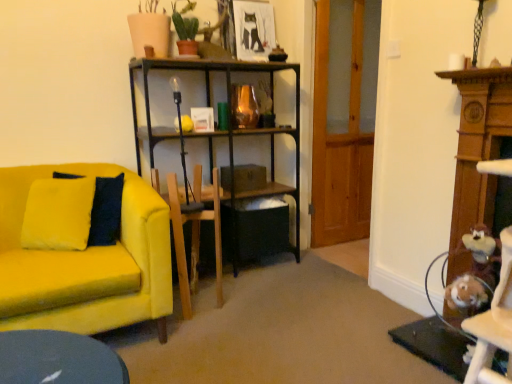
Where is `free space in front of wooden swivel chair at center`? This screenshot has width=512, height=384. free space in front of wooden swivel chair at center is located at coordinates (189, 327).